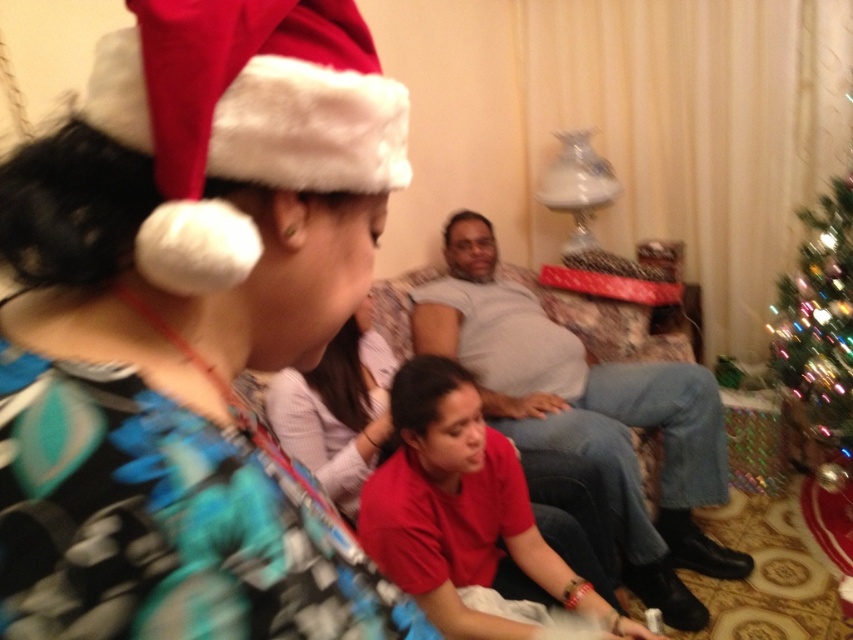
Between red velvet santa hat at upper left and light gray cotton shirt at center, which one is positioned higher?

Positioned higher is red velvet santa hat at upper left.

Between point (320, 172) and point (531, 328), which one is positioned in front?

Point (320, 172)

Is point (126, 49) closer to viewer compared to point (677, 541)?

That is True.

In order to click on red velvet santa hat at upper left in this screenshot , I will do [x=242, y=120].

Between printed fabric dress at upper left and light gray cotton shirt at center, which one has less height?

printed fabric dress at upper left is shorter.

Is point (271, 328) closer to viewer compared to point (688, 404)?

Yes, point (271, 328) is closer to viewer.

Find the location of `printed fabric dress at upper left`. printed fabric dress at upper left is located at coordinates (189, 326).

Which is behind, point (798, 323) or point (289, 396)?

Positioned behind is point (798, 323).

Does green glittering christmas tree at right appear on the left side of matte pink sweater at center?

No, green glittering christmas tree at right is not to the left of matte pink sweater at center.

Who is more distant from viewer, [801,387] or [351,316]?

The point [801,387] is more distant.

At what (x,y) coordinates should I click in order to perform the action: click on green glittering christmas tree at right. Please return your answer as a coordinate pair (x, y). Image resolution: width=853 pixels, height=640 pixels. Looking at the image, I should click on (819, 321).